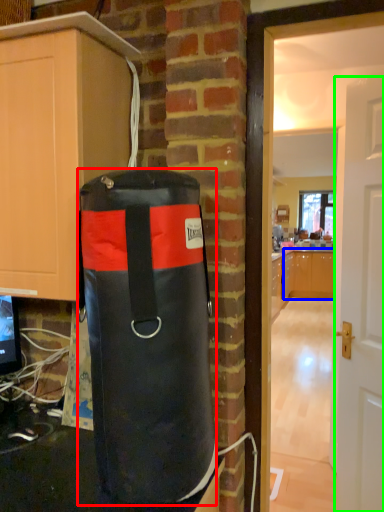
Question: Based on their relative distances, which object is farther from punching bag (highlighted by a red box)? Choose from cabinetry (highlighted by a blue box) and door (highlighted by a green box).

Choices:
 (A) cabinetry
 (B) door

Answer: (A)